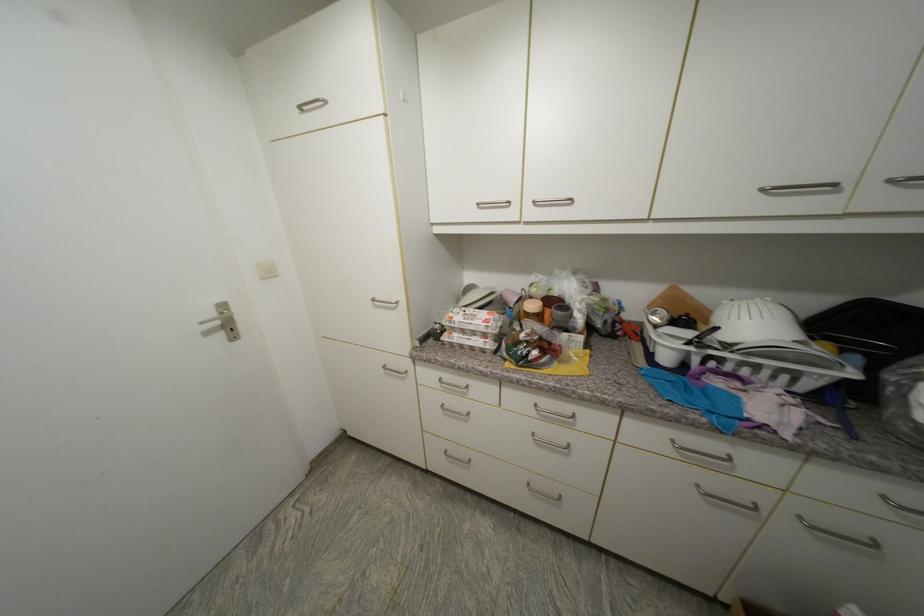
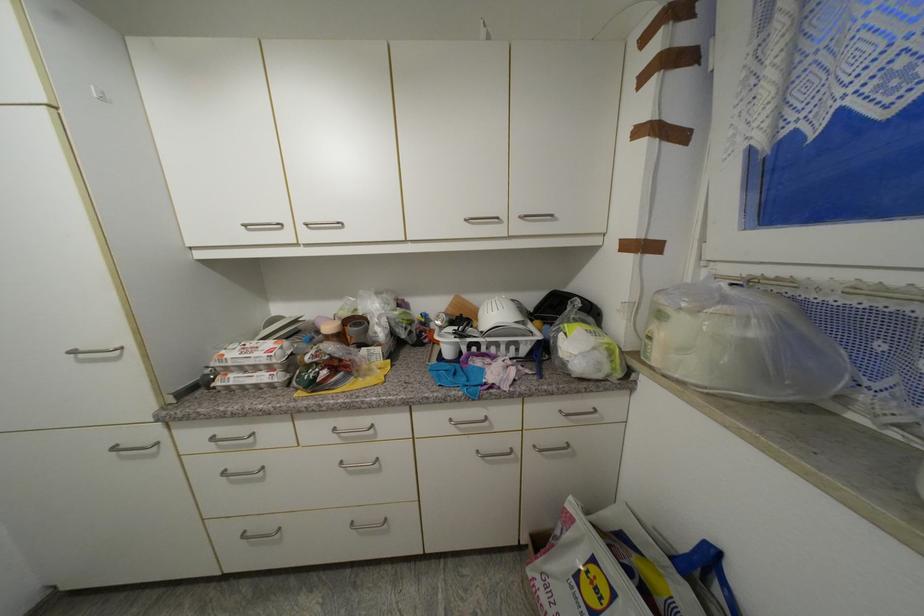
In a continuous first-person perspective shot, in which direction is the camera moving?

The cameraman walked toward right, backward.